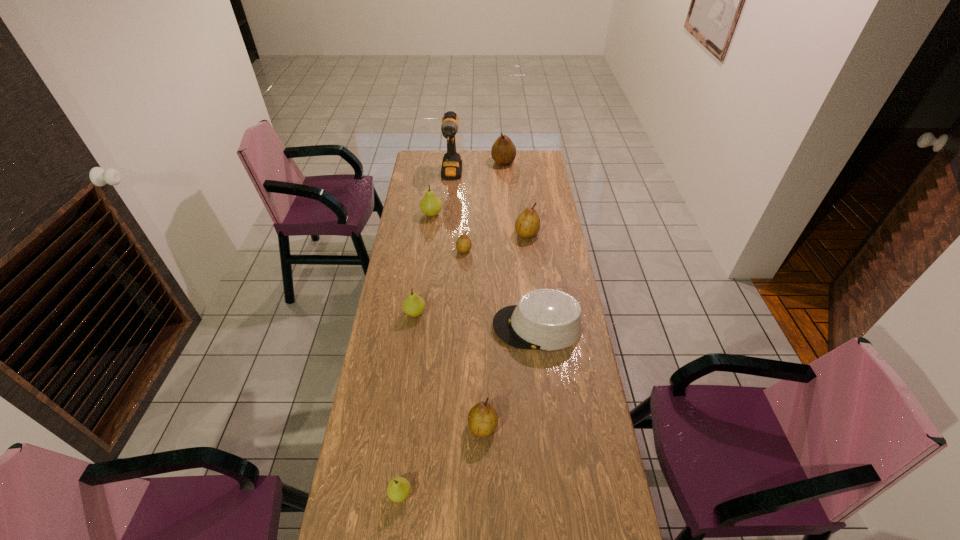
You are a GUI agent. You are given a task and a screenshot of the screen. Output one action in this format:
    pyautogui.click(x=<x>, y=<y>)
    Task: Click on the vacant space located 0.190m on the front of the fifth farthest pear
    The height and width of the screenshot is (540, 960).
    Given the screenshot: What is the action you would take?
    pyautogui.click(x=408, y=362)

Identify the location of free point located on the right of the second smallest brown pear. (564, 426).

Where is `vacant area situated 0.250m on the front-facing side of the hat`? The width and height of the screenshot is (960, 540). vacant area situated 0.250m on the front-facing side of the hat is located at coordinates (428, 327).

Where is `free space located on the front-facing side of the hat`? This screenshot has height=540, width=960. free space located on the front-facing side of the hat is located at coordinates (428, 327).

In order to click on free point located 0.270m on the front-facing side of the hat in this screenshot , I will do `click(422, 327)`.

The width and height of the screenshot is (960, 540). Find the location of `vacant space situated 0.260m on the back of the smallest brown pear`. vacant space situated 0.260m on the back of the smallest brown pear is located at coordinates [x=466, y=211].

Locate an element on the screen. The width and height of the screenshot is (960, 540). free space located on the back of the nearest pear is located at coordinates (415, 371).

You are a GUI agent. You are given a task and a screenshot of the screen. Output one action in this format:
    pyautogui.click(x=<x>, y=<y>)
    Task: Click on the drill present at the far edge
    The height and width of the screenshot is (540, 960).
    Given the screenshot: What is the action you would take?
    pyautogui.click(x=451, y=168)

Image resolution: width=960 pixels, height=540 pixels. I want to click on pear that is at the far edge, so point(503,151).

Find the location of a particular element. Image resolution: width=960 pixels, height=540 pixels. pear present at the right edge is located at coordinates (527, 225).